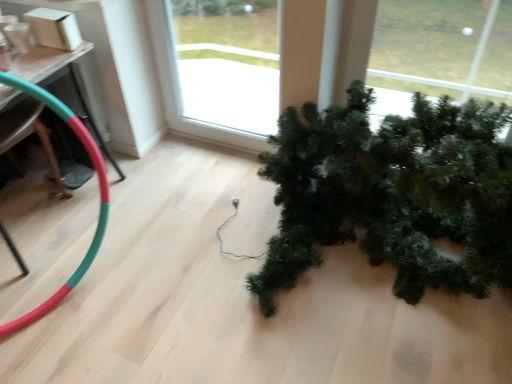
Question: In the image, is rubber green and red garden hose at lower left on the left side or the right side of green matte christmas tree at lower right?

Choices:
 (A) left
 (B) right

Answer: (A)

Question: Based on their sizes in the image, would you say rubber green and red garden hose at lower left is bigger or smaller than green matte christmas tree at lower right?

Choices:
 (A) big
 (B) small

Answer: (B)

Question: Which object is positioned closest to the rubber green and red garden hose at lower left?

Choices:
 (A) transparent glass window at center
 (B) green matte christmas tree at lower right

Answer: (B)

Question: Estimate the real-world distances between objects in this image. Which object is farther from the rubber green and red garden hose at lower left?

Choices:
 (A) transparent glass window at center
 (B) green matte christmas tree at lower right

Answer: (A)